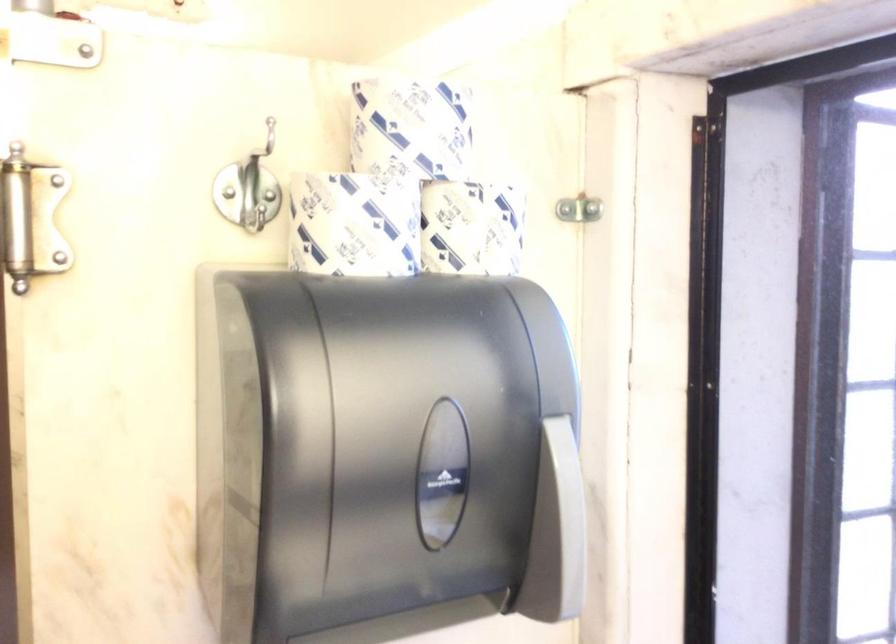
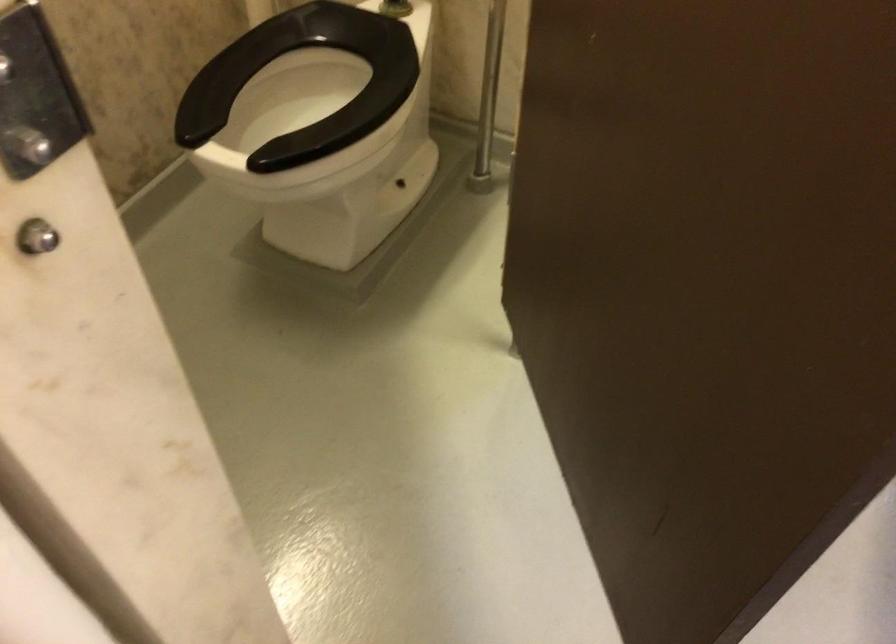
How did the camera likely rotate?

The rotation direction of the camera is right-down.